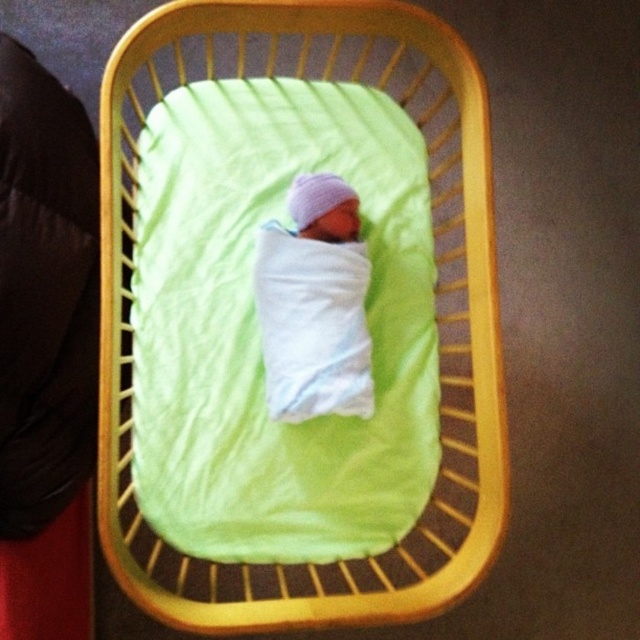
Which is more to the right, wooden crib at center or white soft swaddled newborn at center?

Answer: From the viewer's perspective, wooden crib at center appears more on the right side.

From the picture: Which of these two, wooden crib at center or white soft swaddled newborn at center, stands shorter?

white soft swaddled newborn at center

The width and height of the screenshot is (640, 640). What do you see at coordinates (435, 296) in the screenshot?
I see `wooden crib at center` at bounding box center [435, 296].

At what (x,y) coordinates should I click in order to perform the action: click on wooden crib at center. Please return your answer as a coordinate pair (x, y). The height and width of the screenshot is (640, 640). Looking at the image, I should click on (435, 296).